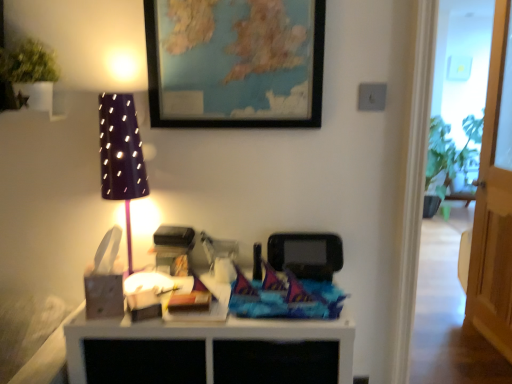
You are a GUI agent. You are given a task and a screenshot of the screen. Output one action in this format:
    pyautogui.click(x=<x>, y=<y>)
    Task: Click on the matte black lampshade at left
    The height and width of the screenshot is (384, 512).
    Given the screenshot: What is the action you would take?
    pyautogui.click(x=121, y=155)

The image size is (512, 384). I want to click on wooden table at center, so click(x=210, y=351).

Describe the element at coordinates (234, 63) in the screenshot. I see `matte black picture frame at upper center` at that location.

Identify the location of green matte plant at upper left. (28, 63).

What do you see at coordinates (494, 199) in the screenshot?
I see `transparent wooden door at right` at bounding box center [494, 199].

Find the location of `matte black lampshade at left`. matte black lampshade at left is located at coordinates (121, 155).

Who is shorter, transparent wooden door at right or wooden table at center?

With less height is wooden table at center.

Considering the sizes of transparent wooden door at right and wooden table at center in the image, is transparent wooden door at right bigger or smaller than wooden table at center?

transparent wooden door at right is smaller than wooden table at center.

Is transparent wooden door at right in front of or behind wooden table at center in the image?

Clearly, transparent wooden door at right is behind wooden table at center.

Is point (495, 51) closer or farther from the camera than point (69, 323)?

Clearly, point (495, 51) is more distant from the camera than point (69, 323).

Between matte black picture frame at upper center and matte black lampshade at left, which one has smaller size?

Smaller between the two is matte black lampshade at left.

Between matte black picture frame at upper center and matte black lampshade at left, which one has less height?

Standing shorter between the two is matte black picture frame at upper center.

Which is more distant, (315, 119) or (143, 162)?

The point (315, 119) is farther from the camera.

Can you confirm if matte black picture frame at upper center is thinner than matte black lampshade at left?

Yes.

From the image's perspective, which one is positioned lower, matte black lampshade at left or transparent wooden door at right?

matte black lampshade at left.

Considering the positions of points (122, 157) and (495, 115), is point (122, 157) farther from camera compared to point (495, 115)?

No, it is in front of (495, 115).

Measure the distance between matte black lampshade at left and transparent wooden door at right.

They are 6.42 feet apart.

Between matte black lampshade at left and transparent wooden door at right, which one has smaller width?

With smaller width is transparent wooden door at right.

From the image's perspective, which is above, wooden table at center or matte black lampshade at left?

matte black lampshade at left appears higher in the image.

In the scene shown: Considering the sizes of wooden table at center and matte black lampshade at left in the image, is wooden table at center wider or thinner than matte black lampshade at left?

In the image, wooden table at center appears to be wider than matte black lampshade at left.

Is point (151, 339) closer to viewer compared to point (145, 190)?

Yes.

Who is shorter, matte black lampshade at left or wooden table at center?

Standing shorter between the two is wooden table at center.

Would you say matte black lampshade at left is outside wooden table at center?

Yes, matte black lampshade at left is outside of wooden table at center.

Consider the image. Does matte black lampshade at left lie in front of wooden table at center?

No, matte black lampshade at left is behind wooden table at center.

Where is `glass door on the right of matte black picture frame at upper center`? glass door on the right of matte black picture frame at upper center is located at coordinates point(494,199).

Based on the photo, which object is closer to the camera, transparent wooden door at right or matte black picture frame at upper center?

matte black picture frame at upper center is more forward.

Could you tell me if transparent wooden door at right is facing matte black picture frame at upper center?

No, transparent wooden door at right is not turned towards matte black picture frame at upper center.

Can you confirm if transparent wooden door at right is smaller than matte black picture frame at upper center?

No.

Could you tell me if wooden table at center is turned towards matte black picture frame at upper center?

No, wooden table at center does not turn towards matte black picture frame at upper center.

Is wooden table at center to the left or to the right of matte black picture frame at upper center in the image?

From the image, it's evident that wooden table at center is to the left of matte black picture frame at upper center.

From a real-world perspective, is wooden table at center physically below matte black picture frame at upper center?

Yes.

Where is `table that is on the left side of transparent wooden door at right`? This screenshot has width=512, height=384. table that is on the left side of transparent wooden door at right is located at coordinates (210, 351).

You are a GUI agent. You are given a task and a screenshot of the screen. Output one action in this format:
    pyautogui.click(x=<x>, y=<y>)
    Task: Click on the picture frame above the matte black lampshade at left (from the image's perspective)
    The height and width of the screenshot is (384, 512).
    Given the screenshot: What is the action you would take?
    pyautogui.click(x=234, y=63)

Estimate the real-world distances between objects in this image. Which object is closer to wooden table at center, matte black lampshade at left or matte black picture frame at upper center?

matte black lampshade at left is positioned closer to the anchor wooden table at center.

From the image, which object appears to be nearer to green matte plant at upper left, wooden table at center or matte black lampshade at left?

matte black lampshade at left is closer to green matte plant at upper left.

Looking at the image, which one is located further to green matte plant at upper left, matte black lampshade at left or matte black picture frame at upper center?

matte black picture frame at upper center is positioned further to the anchor green matte plant at upper left.

From the image, which object appears to be farther from wooden table at center, transparent wooden door at right or matte black lampshade at left?

transparent wooden door at right.

From the picture: When comparing their distances from matte black picture frame at upper center, does transparent wooden door at right or green matte plant at upper left seem further?

The object further to matte black picture frame at upper center is transparent wooden door at right.

From the image, which object appears to be nearer to wooden table at center, matte black picture frame at upper center or green matte plant at upper left?

Based on the image, matte black picture frame at upper center appears to be nearer to wooden table at center.

Which object lies nearer to the anchor point matte black lampshade at left, matte black picture frame at upper center or green matte plant at upper left?

matte black picture frame at upper center.

From the image, which object appears to be nearer to green matte plant at upper left, matte black picture frame at upper center or wooden table at center?

Among the two, matte black picture frame at upper center is located nearer to green matte plant at upper left.

Locate an element on the screen. The height and width of the screenshot is (384, 512). picture frame between green matte plant at upper left and transparent wooden door at right is located at coordinates (234, 63).

The image size is (512, 384). In order to click on plant between matte black picture frame at upper center and wooden table at center in the vertical direction in this screenshot , I will do `click(28, 63)`.

Locate an element on the screen. This screenshot has height=384, width=512. table lamp situated between green matte plant at upper left and matte black picture frame at upper center from left to right is located at coordinates (121, 155).

The image size is (512, 384). In order to click on table located between green matte plant at upper left and transparent wooden door at right in the left-right direction in this screenshot , I will do `click(210, 351)`.